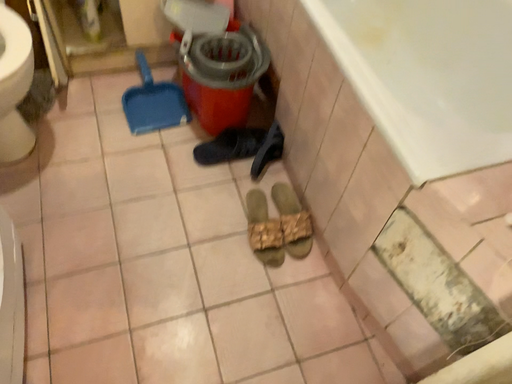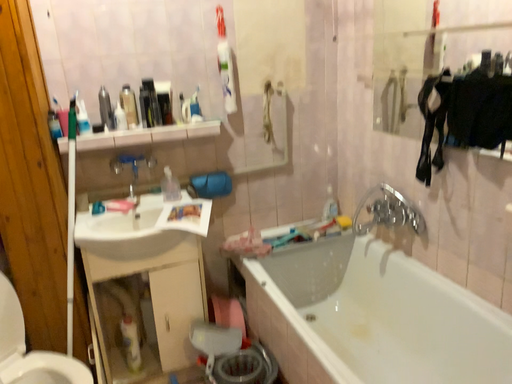
Question: How did the camera likely rotate when shooting the video?

Choices:
 (A) rotated upward
 (B) rotated downward

Answer: (A)